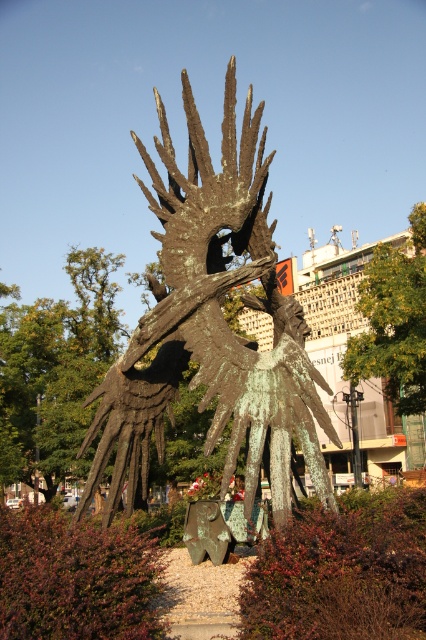
Question: Can you confirm if green patina metal sculpture at center is smaller than green patina sculpture at center?

Choices:
 (A) yes
 (B) no

Answer: (B)

Question: Which object appears farthest from the camera in this image?

Choices:
 (A) green patina metal sculpture at center
 (B) green patina sculpture at center

Answer: (A)

Question: Is green patina metal sculpture at center closer to the viewer compared to green patina sculpture at center?

Choices:
 (A) no
 (B) yes

Answer: (A)

Question: Which object appears farthest from the camera in this image?

Choices:
 (A) green patina metal sculpture at center
 (B) green patina sculpture at center

Answer: (A)

Question: Among these objects, which one is farthest from the camera?

Choices:
 (A) green patina metal sculpture at center
 (B) green patina sculpture at center

Answer: (A)

Question: Is green patina metal sculpture at center to the left of green patina sculpture at center from the viewer's perspective?

Choices:
 (A) no
 (B) yes

Answer: (B)